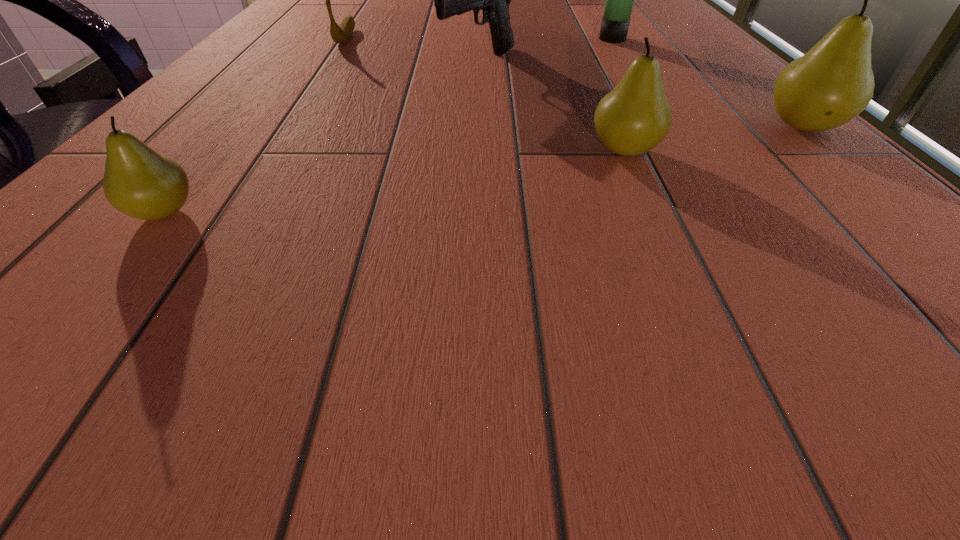
Where is `the closest pear to the leftmost object`? Image resolution: width=960 pixels, height=540 pixels. the closest pear to the leftmost object is located at coordinates (632, 119).

I want to click on vacant space that satisfies the following two spatial constraints: 1. at the muzzle of the fourth object from right to left; 2. on the right side of the second shortest pear, so [479, 151].